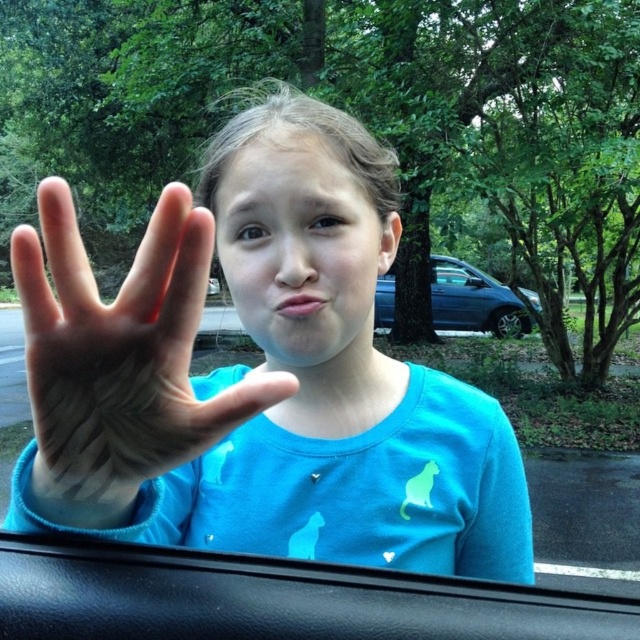
Question: Is matte blue shirt at center to the right of black leather car door at lower center from the viewer's perspective?

Choices:
 (A) no
 (B) yes

Answer: (A)

Question: In this image, where is matte skin hand at center located relative to black leather car door at lower center?

Choices:
 (A) left
 (B) right

Answer: (A)

Question: Estimate the real-world distances between objects in this image. Which object is farther from the blue metallic car at center?

Choices:
 (A) black leather car door at lower center
 (B) matte skin hand at center

Answer: (B)

Question: Which object is the farthest from the black leather car door at lower center?

Choices:
 (A) matte skin hand at center
 (B) blue metallic car at center
 (C) matte blue shirt at center

Answer: (B)

Question: Based on their relative distances, which object is nearer to the matte blue shirt at center?

Choices:
 (A) black leather car door at lower center
 (B) blue metallic car at center

Answer: (A)

Question: Is matte blue shirt at center to the left of matte skin hand at center from the viewer's perspective?

Choices:
 (A) no
 (B) yes

Answer: (A)